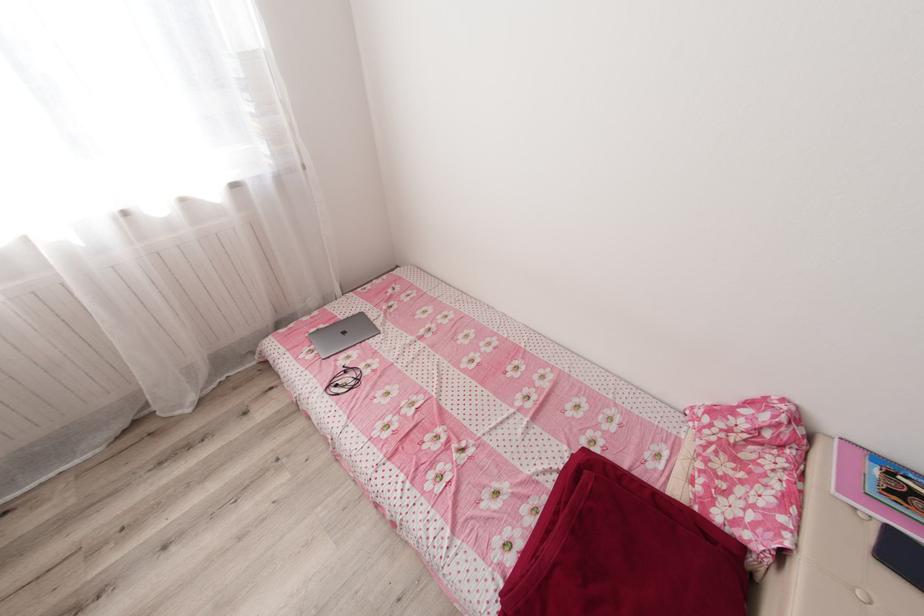
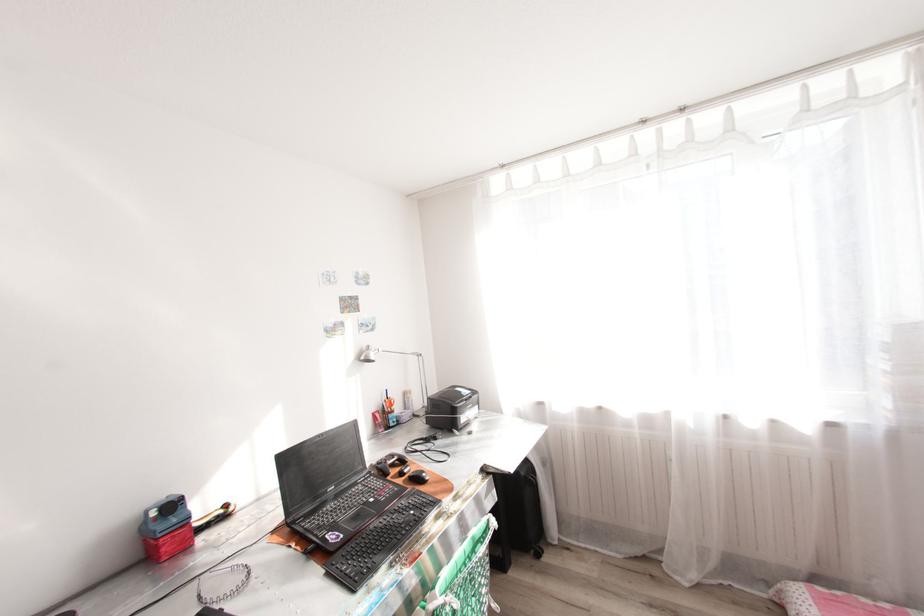
Question: How did the camera likely rotate?

Choices:
 (A) Left
 (B) Right
 (C) Up
 (D) Down

Answer: (A)